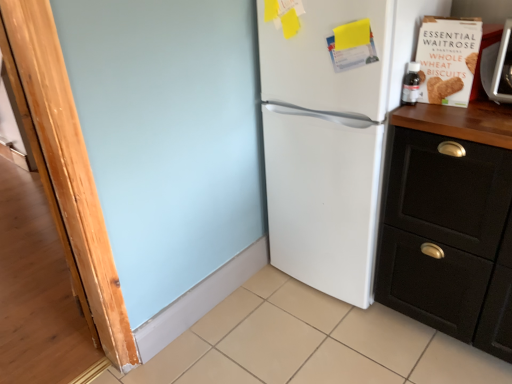
Locate an element on the screen. The height and width of the screenshot is (384, 512). vacant space situated above beige tile at lower center (from a real-world perspective) is located at coordinates (308, 342).